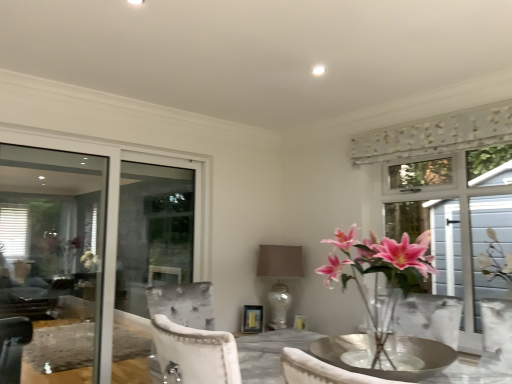
Question: Is satin beige lampshade at center outside clear glass window at left?

Choices:
 (A) no
 (B) yes

Answer: (B)

Question: Is satin beige lampshade at center smaller than clear glass window at left?

Choices:
 (A) yes
 (B) no

Answer: (A)

Question: Does satin beige lampshade at center touch clear glass window at left?

Choices:
 (A) yes
 (B) no

Answer: (B)

Question: Can clear glass window at left be found inside satin beige lampshade at center?

Choices:
 (A) no
 (B) yes

Answer: (A)

Question: Is satin beige lampshade at center aimed at clear glass window at left?

Choices:
 (A) yes
 (B) no

Answer: (A)

Question: Can you confirm if satin beige lampshade at center is thinner than clear glass window at left?

Choices:
 (A) yes
 (B) no

Answer: (B)

Question: From a real-world perspective, is clear glass window at left on white textured screen at right?

Choices:
 (A) no
 (B) yes

Answer: (B)

Question: Can you confirm if clear glass window at left is shorter than white textured screen at right?

Choices:
 (A) yes
 (B) no

Answer: (B)

Question: From a real-world perspective, is clear glass window at left physically below white textured screen at right?

Choices:
 (A) no
 (B) yes

Answer: (A)

Question: Is clear glass window at left taller than white textured screen at right?

Choices:
 (A) yes
 (B) no

Answer: (A)

Question: Considering the relative sizes of clear glass window at left and white textured screen at right in the image provided, is clear glass window at left smaller than white textured screen at right?

Choices:
 (A) yes
 (B) no

Answer: (B)

Question: Is clear glass window at left further to camera compared to white textured screen at right?

Choices:
 (A) yes
 (B) no

Answer: (A)

Question: Does white textured screen at right have a greater height compared to clear glass window at left?

Choices:
 (A) no
 (B) yes

Answer: (A)